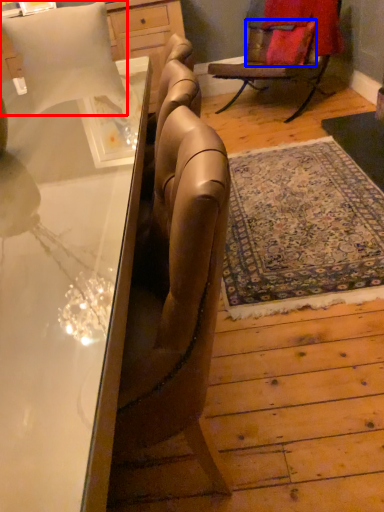
Question: Which object is further to the camera taking this photo, pillow (highlighted by a red box) or pillow (highlighted by a blue box)?

Choices:
 (A) pillow
 (B) pillow

Answer: (B)